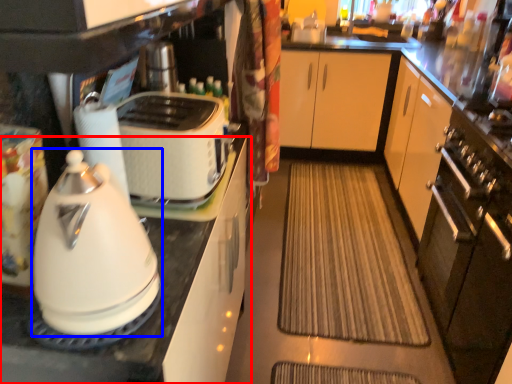
Question: Which of the following is the farthest to the observer, cabinetry (highlighted by a red box) or kitchen appliance (highlighted by a blue box)?

Choices:
 (A) cabinetry
 (B) kitchen appliance

Answer: (A)